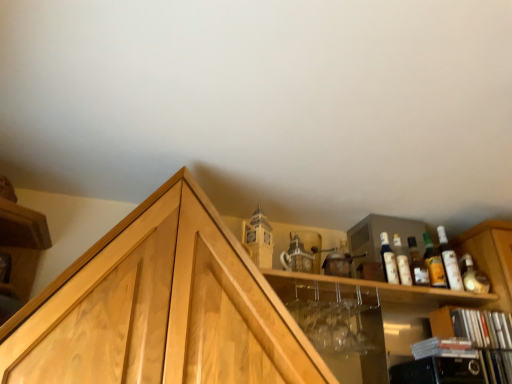
Question: In the image, is black plastic cds at lower right, placed as the second cabinetry when sorted from left to right, on the left side or the right side of matte orange glass bottle at upper right?

Choices:
 (A) right
 (B) left

Answer: (A)

Question: Considering the positions of black plastic cds at lower right, placed as the second cabinetry when sorted from left to right, and matte orange glass bottle at upper right in the image, is black plastic cds at lower right, placed as the second cabinetry when sorted from left to right, bigger or smaller than matte orange glass bottle at upper right?

Choices:
 (A) big
 (B) small

Answer: (A)

Question: Estimate the real-world distances between objects in this image. Which object is closer to the matte orange glass bottle at upper right?

Choices:
 (A) wooden cabinet at upper center, placed as the 2th cabinetry when sorted from right to left
 (B) white glossy bottles at upper right, the third bottle in the right-to-left sequence
 (C) translucent glass bottle at upper right, positioned as the third bottle in left-to-right order
 (D) matte glass bottle at upper right, the 4th bottle from the right
 (E) matte glass bottle at upper right, the first bottle viewed from the right

Answer: (C)

Question: Which is nearer to the matte glass bottle at upper right, which is the fourth bottle from left to right?

Choices:
 (A) matte glass bottle at upper right, the 4th bottle from the right
 (B) translucent glass bottle at upper right, positioned as the second bottle in right-to-left order
 (C) matte orange glass bottle at upper right
 (D) wooden cabinet at upper center, placed as the 2th cabinetry when sorted from right to left
 (E) white glossy bottles at upper right, placed as the second bottle when sorted from left to right

Answer: (C)